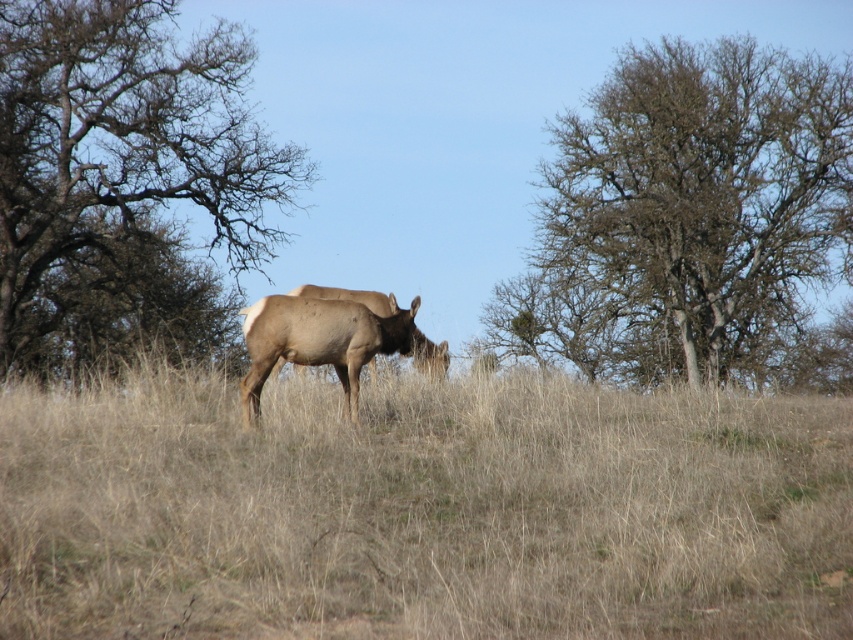
You are a photographer trying to capture a photo of the brown furry deer at center without the brown bark tree at left appearing in the frame. Is it possible to do so by moving closer to the deer?

The brown bark tree at left has a larger size compared to brown furry deer at center. Since the tree is larger, moving closer to the deer might still leave the tree visible in the frame unless you position yourself at an angle where the tree is completely out of view.

You are a hiker trying to spot the brown furry deer at center in the grassy field. From your vantage point, which direction should you look relative to the brown dry grass at center to find the deer?

The brown dry grass at center is to the right of the brown furry deer at center, so you should look to the left of the brown dry grass at center to find the deer.

You are a hiker trying to navigate through the field. You see the brown rough bark tree at upper right and the brown bark tree at left. Which tree should you look up to see the taller one?

The brown rough bark tree at upper right is much taller than the brown bark tree at left, so you should look up at the brown rough bark tree at upper right to see the taller one.